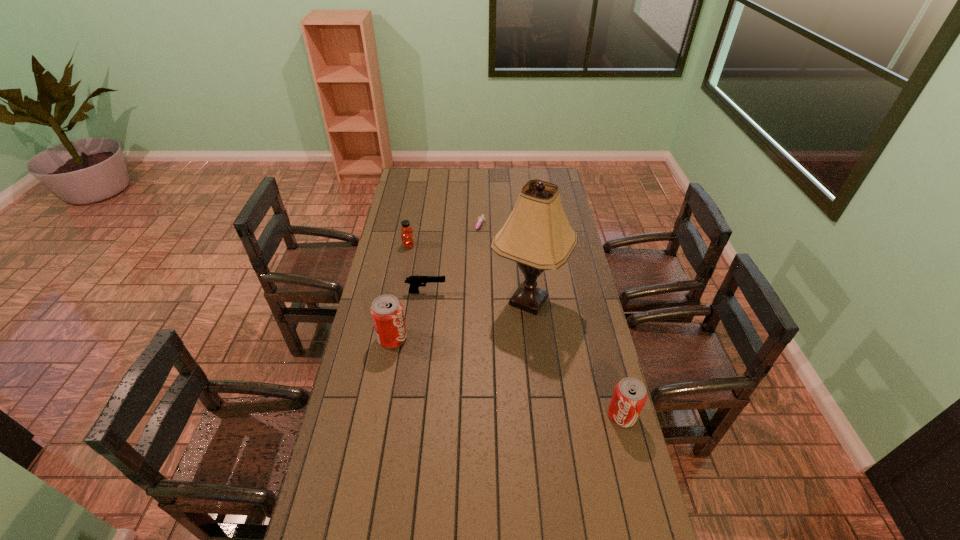
Locate an element on the screen. The image size is (960, 540). soda can that is at the right edge is located at coordinates (630, 395).

Find the location of a particular element. The image size is (960, 540). lamp that is positioned at the right edge is located at coordinates (x=537, y=235).

The width and height of the screenshot is (960, 540). In the image, there is a desktop. In order to click on blank space at the far edge in this screenshot , I will do `click(451, 170)`.

This screenshot has width=960, height=540. What are the coordinates of `free region at the near edge of the desktop` in the screenshot? It's located at (566, 534).

Find the location of `blank space at the left edge of the desktop`. blank space at the left edge of the desktop is located at coordinates (396, 354).

Locate an element on the screen. The width and height of the screenshot is (960, 540). free space at the right edge of the desktop is located at coordinates (567, 368).

This screenshot has width=960, height=540. In order to click on vacant area that lies between the fourth object from left to right and the pistol in this screenshot , I will do `click(453, 260)`.

Where is `empty space between the fifth shortest object and the shortest object`? The image size is (960, 540). empty space between the fifth shortest object and the shortest object is located at coordinates (436, 283).

At what (x,y) coordinates should I click in order to perform the action: click on free space between the shorter soda can and the shortest object. Please return your answer as a coordinate pair (x, y). Looking at the image, I should click on (551, 321).

Locate an element on the screen. This screenshot has height=540, width=960. vacant area between the second object from right to left and the honey is located at coordinates (468, 273).